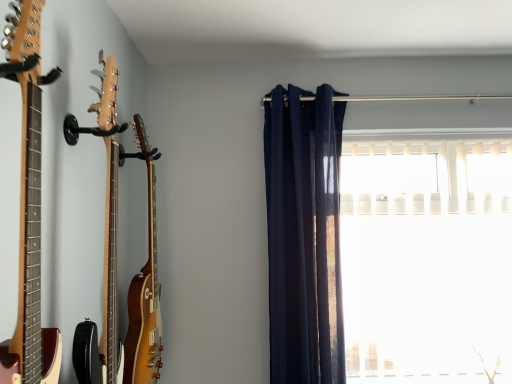
Question: From a real-world perspective, is white plastic blinds at right under wooden acoustic guitar at left, which appears as the 1th guitar when viewed from the front?

Choices:
 (A) yes
 (B) no

Answer: (A)

Question: Is white plastic blinds at right not close to wooden acoustic guitar at left, positioned as the third guitar in back-to-front order?

Choices:
 (A) yes
 (B) no

Answer: (A)

Question: Considering the relative positions of white plastic blinds at right and wooden acoustic guitar at left, positioned as the third guitar in back-to-front order, in the image provided, is white plastic blinds at right to the right of wooden acoustic guitar at left, positioned as the third guitar in back-to-front order, from the viewer's perspective?

Choices:
 (A) no
 (B) yes

Answer: (B)

Question: Is white plastic blinds at right further to the viewer compared to wooden acoustic guitar at left, which appears as the 1th guitar when viewed from the front?

Choices:
 (A) yes
 (B) no

Answer: (A)

Question: Is white plastic blinds at right shorter than wooden acoustic guitar at left, which appears as the 1th guitar when viewed from the front?

Choices:
 (A) yes
 (B) no

Answer: (B)

Question: Do you think glossy wood guitar at left, which is counted as the 1th guitar, starting from the back, is within light brown wood guitar at left, which ranks as the second guitar in back-to-front order, or outside of it?

Choices:
 (A) inside
 (B) outside

Answer: (B)

Question: From a real-world perspective, is glossy wood guitar at left, which is counted as the 1th guitar, starting from the back, positioned above or below light brown wood guitar at left, which ranks as the second guitar in back-to-front order?

Choices:
 (A) below
 (B) above

Answer: (A)

Question: Visually, is glossy wood guitar at left, positioned as the third guitar in front-to-back order, positioned to the left or to the right of light brown wood guitar at left, the second guitar when ordered from front to back?

Choices:
 (A) left
 (B) right

Answer: (A)

Question: In terms of width, does glossy wood guitar at left, positioned as the third guitar in front-to-back order, look wider or thinner when compared to light brown wood guitar at left, the second guitar when ordered from front to back?

Choices:
 (A) thin
 (B) wide

Answer: (A)

Question: In terms of height, does wooden acoustic guitar at left, positioned as the third guitar in back-to-front order, look taller or shorter compared to glossy wood guitar at left, which is counted as the 1th guitar, starting from the back?

Choices:
 (A) tall
 (B) short

Answer: (B)

Question: Which is correct: wooden acoustic guitar at left, which appears as the 1th guitar when viewed from the front, is inside glossy wood guitar at left, which is counted as the 1th guitar, starting from the back, or outside of it?

Choices:
 (A) inside
 (B) outside

Answer: (B)

Question: Based on their positions, is wooden acoustic guitar at left, positioned as the third guitar in back-to-front order, located to the left or right of glossy wood guitar at left, which is counted as the 1th guitar, starting from the back?

Choices:
 (A) left
 (B) right

Answer: (B)

Question: Looking at the image, does wooden acoustic guitar at left, positioned as the third guitar in back-to-front order, seem bigger or smaller compared to glossy wood guitar at left, which is counted as the 1th guitar, starting from the back?

Choices:
 (A) small
 (B) big

Answer: (A)

Question: Does point (121, 357) appear closer or farther from the camera than point (129, 309)?

Choices:
 (A) farther
 (B) closer

Answer: (B)

Question: Based on their sizes in the image, would you say light brown wood guitar at left, the second guitar when ordered from front to back, is bigger or smaller than glossy wood guitar at left, which is counted as the 1th guitar, starting from the back?

Choices:
 (A) small
 (B) big

Answer: (A)